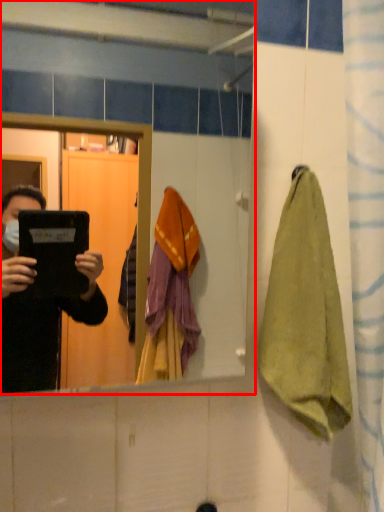
Question: Observing the image, what is the correct spatial positioning of mirror (annotated by the red box) in reference to towel/napkin?

Choices:
 (A) right
 (B) left

Answer: (B)